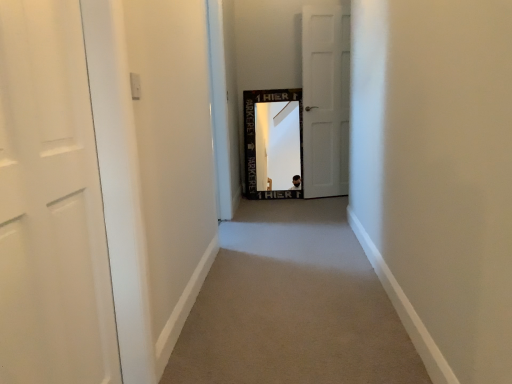
Where is `white matte door at left, marked as the 1th door in a front-to-back arrangement`? white matte door at left, marked as the 1th door in a front-to-back arrangement is located at coordinates (51, 205).

In the image, there is a white matte door at left, which appears as the second door when viewed from the right. Where is `alley below it (from a real-world perspective)`? This screenshot has height=384, width=512. alley below it (from a real-world perspective) is located at coordinates (292, 305).

From the picture: Does carpet at center turn towards white matte door at left, arranged as the 1th door when viewed from the left?

No.

Measure the distance from carpet at center to white matte door at left, marked as the 1th door in a front-to-back arrangement.

The distance of carpet at center from white matte door at left, marked as the 1th door in a front-to-back arrangement, is 3.47 feet.

Is carpet at center further to the viewer compared to white matte door at left, which appears as the second door when viewed from the right?

Yes.

Which point is more forward, (61, 366) or (306, 192)?

The point (61, 366) is closer to the camera.

Does white matte door at left, arranged as the 1th door when viewed from the left, have a lesser height compared to white matte door at center, which is the second door in left-to-right order?

Answer: Correct, white matte door at left, arranged as the 1th door when viewed from the left, is not as tall as white matte door at center, which is the second door in left-to-right order.

The image size is (512, 384). I want to click on door above the white matte door at left, which appears as the second door when viewed from the right (from the image's perspective), so click(325, 100).

From the image's perspective, is white matte door at left, arranged as the 1th door when viewed from the left, located beneath white matte door at center, the first door from the right?

Correct, white matte door at left, arranged as the 1th door when viewed from the left, appears lower than white matte door at center, the first door from the right, in the image.

Are white matte door at center, placed as the second door when sorted from front to back, and carpet at center beside each other?

No, white matte door at center, placed as the second door when sorted from front to back, is not in contact with carpet at center.

From a real-world perspective, which is physically below, white matte door at center, the 1th door from the back, or carpet at center?

carpet at center is physically lower.

Based on the photo, which of these two, white matte door at center, which is the second door in left-to-right order, or carpet at center, stands taller?

With more height is white matte door at center, which is the second door in left-to-right order.

Which of these two, white matte door at center, which is the second door in left-to-right order, or carpet at center, is thinner?

Thinner between the two is white matte door at center, which is the second door in left-to-right order.

From a real-world perspective, between carpet at center and white matte door at center, placed as the second door when sorted from front to back, who is vertically lower?

carpet at center.

From the picture: From the image's perspective, which is above, carpet at center or white matte door at center, which is the second door in left-to-right order?

white matte door at center, which is the second door in left-to-right order.

Is white matte door at center, the first door from the right, inside carpet at center?

Definitely not — white matte door at center, the first door from the right, is not inside carpet at center.

Would you say carpet at center is to the left or to the right of white matte door at center, which is the second door in left-to-right order, in the picture?

Clearly, carpet at center is on the left of white matte door at center, which is the second door in left-to-right order, in the image.

Looking at this image, could you measure the distance between white matte door at center, placed as the second door when sorted from front to back, and white matte door at left, positioned as the 2th door in back-to-front order?

white matte door at center, placed as the second door when sorted from front to back, is 3.46 meters from white matte door at left, positioned as the 2th door in back-to-front order.

Which is in front, point (323, 51) or point (42, 52)?

The point (42, 52) is closer to the camera.

At what (x,y) coordinates should I click in order to perform the action: click on door below the white matte door at center, the first door from the right (from the image's perspective). Please return your answer as a coordinate pair (x, y). This screenshot has height=384, width=512. Looking at the image, I should click on (51, 205).

From the picture: What's the angular difference between white matte door at center, which is the second door in left-to-right order, and white matte door at left, which appears as the second door when viewed from the right,'s facing directions?

74.2 degrees.

What's the angular difference between white matte door at left, arranged as the 1th door when viewed from the left, and carpet at center's facing directions?

92.4 degrees.

Which of these two, white matte door at left, which appears as the second door when viewed from the right, or carpet at center, is bigger?

carpet at center is bigger.

Which point is more distant from viewer, (87,334) or (351,242)?

The point (351,242) is more distant.

From their relative heights in the image, would you say white matte door at left, which appears as the second door when viewed from the right, is taller or shorter than carpet at center?

In the image, white matte door at left, which appears as the second door when viewed from the right, appears to be taller than carpet at center.

The height and width of the screenshot is (384, 512). I want to click on the 1st door directly above the carpet at center (from a real-world perspective), so [x=51, y=205].

Identify the location of door lying behind the white matte door at left, positioned as the 2th door in back-to-front order. The height and width of the screenshot is (384, 512). (325, 100).

Looking at the image, which one is located further to white matte door at center, placed as the second door when sorted from front to back, white matte door at left, marked as the 1th door in a front-to-back arrangement, or carpet at center?

Among the two, white matte door at left, marked as the 1th door in a front-to-back arrangement, is located further to white matte door at center, placed as the second door when sorted from front to back.

Estimate the real-world distances between objects in this image. Which object is further from carpet at center, white matte door at left, positioned as the 2th door in back-to-front order, or white matte door at center, the first door from the right?

white matte door at center, the first door from the right, is positioned further to the anchor carpet at center.

Estimate the real-world distances between objects in this image. Which object is further from white matte door at center, the 1th door from the back, carpet at center or white matte door at left, which appears as the second door when viewed from the right?

white matte door at left, which appears as the second door when viewed from the right, lies further to white matte door at center, the 1th door from the back, than the other object.

Estimate the real-world distances between objects in this image. Which object is closer to white matte door at left, positioned as the 2th door in back-to-front order, white matte door at center, placed as the second door when sorted from front to back, or carpet at center?

carpet at center is closer to white matte door at left, positioned as the 2th door in back-to-front order.

Considering their positions, is white matte door at center, the first door from the right, positioned further to carpet at center than white matte door at left, arranged as the 1th door when viewed from the left?

white matte door at center, the first door from the right, is positioned further to the anchor carpet at center.

Based on their spatial positions, is carpet at center or white matte door at center, the first door from the right, further from white matte door at left, marked as the 1th door in a front-to-back arrangement?

white matte door at center, the first door from the right, is further to white matte door at left, marked as the 1th door in a front-to-back arrangement.

You are a GUI agent. You are given a task and a screenshot of the screen. Output one action in this format:
    pyautogui.click(x=<x>, y=<y>)
    Task: Click on the alley between white matte door at left, arranged as the 1th door when viewed from the left, and white matte door at center, the first door from the right, from front to back
    The height and width of the screenshot is (384, 512).
    Given the screenshot: What is the action you would take?
    coord(292,305)